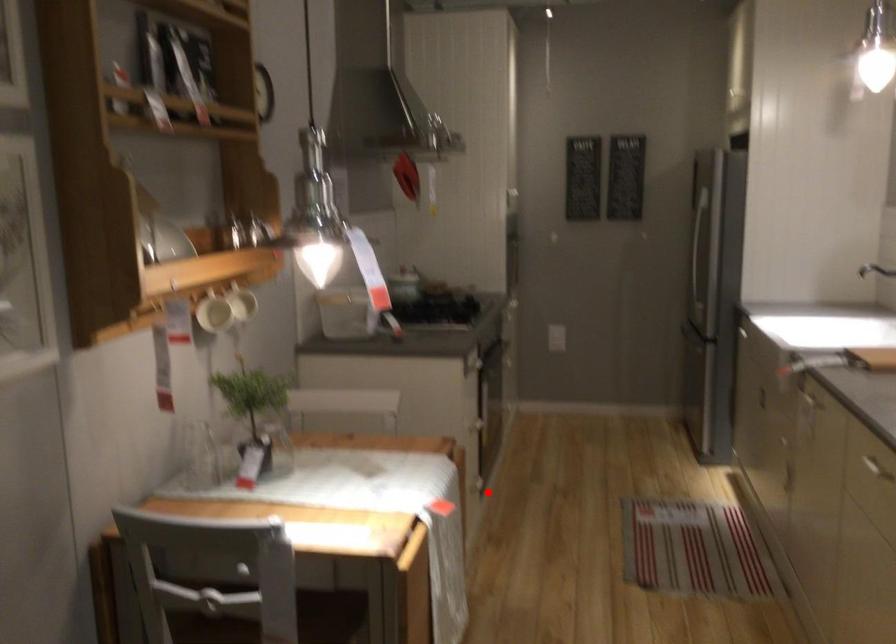
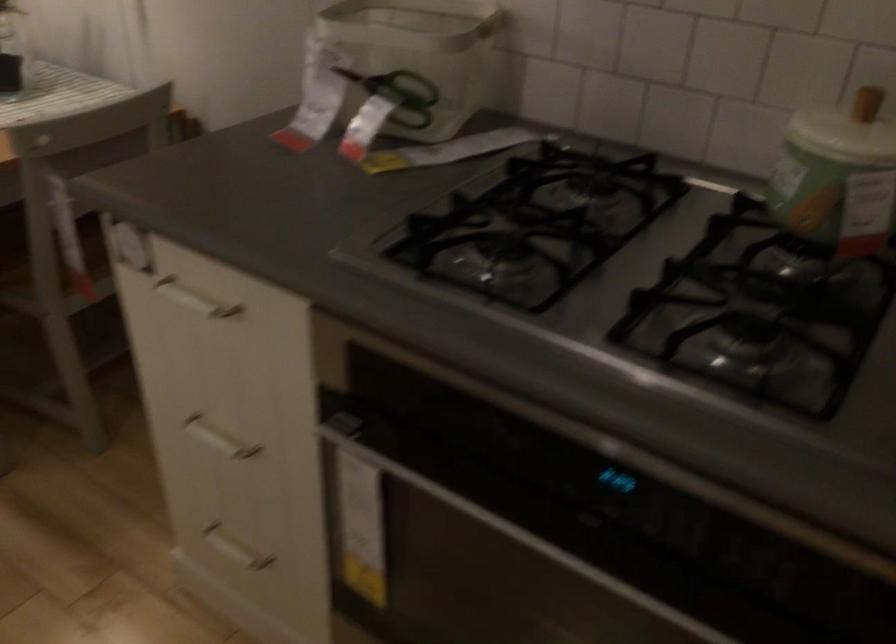
In the second image, find the point that corresponds to the highlighted location in the first image.

(234, 549)